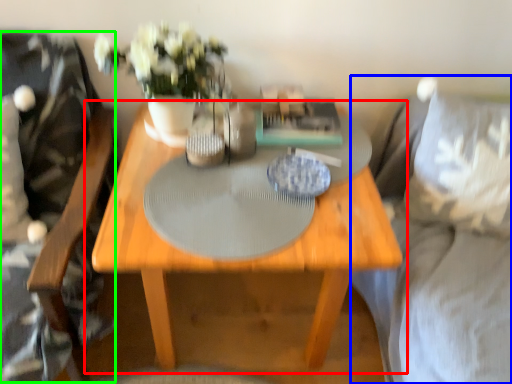
Question: Which is nearer to the table (highlighted by a red box)? couch (highlighted by a blue box) or swivel chair (highlighted by a green box).

Choices:
 (A) couch
 (B) swivel chair

Answer: (B)